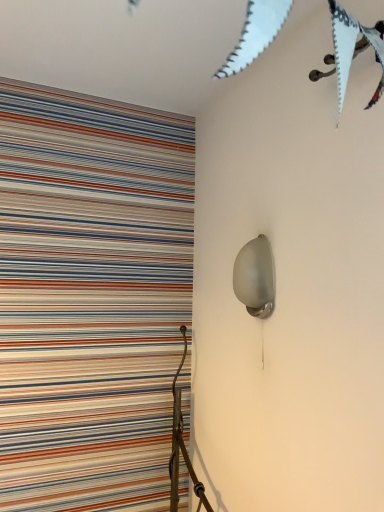
Describe the element at coordinates (255, 277) in the screenshot. I see `satin white sconce at upper right` at that location.

Find the location of a particular element. The image size is (384, 512). satin white sconce at upper right is located at coordinates (255, 277).

Locate an element on the screen. The width and height of the screenshot is (384, 512). satin white sconce at upper right is located at coordinates (255, 277).